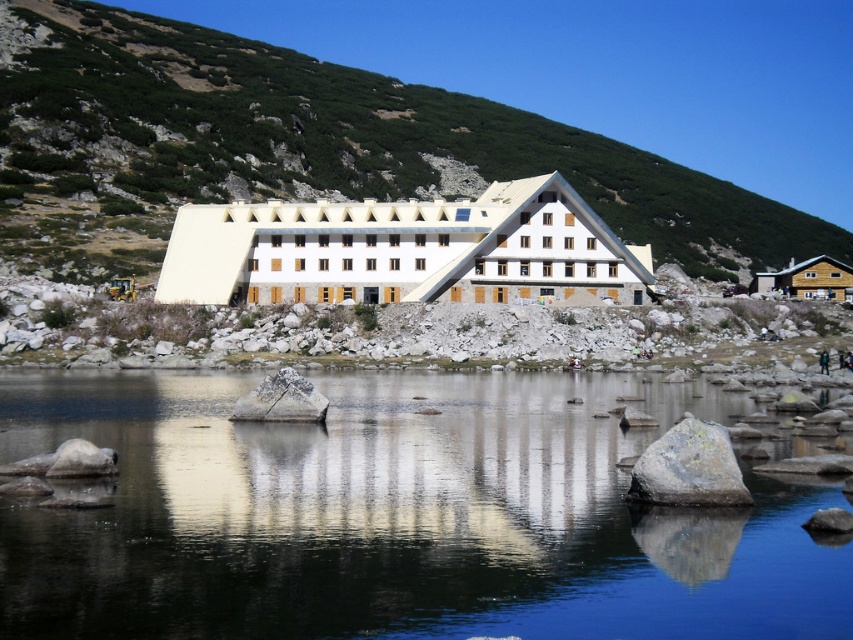
Can you confirm if green grassy hillside at center is taller than white stone building at center?

Indeed, green grassy hillside at center has a greater height compared to white stone building at center.

How much distance is there between green grassy hillside at center and white stone building at center?

A: green grassy hillside at center is 254.39 feet from white stone building at center.

Identify the location of green grassy hillside at center. (302, 148).

Find the location of `green grassy hillside at center`. green grassy hillside at center is located at coordinates (302, 148).

Who is taller, gray rough rock at center or gray rock at center?

Standing taller between the two is gray rough rock at center.

Is gray rough rock at center further to the viewer compared to gray rock at center?

That is False.

Is point (711, 467) farther from camera compared to point (257, 392)?

No, (711, 467) is closer to viewer.

You are a GUI agent. You are given a task and a screenshot of the screen. Output one action in this format:
    pyautogui.click(x=<x>, y=<y>)
    Task: Click on the gray rough rock at center
    This screenshot has width=853, height=640.
    Given the screenshot: What is the action you would take?
    pyautogui.click(x=689, y=468)

Who is more forward, (700, 467) or (86, 468)?

Point (700, 467) is in front.

Does gray rough rock at center have a larger size compared to gray rock at lower left?

Indeed, gray rough rock at center has a larger size compared to gray rock at lower left.

Is point (680, 481) positioned after point (96, 458)?

No, it is in front of (96, 458).

The image size is (853, 640). I want to click on gray rough rock at center, so click(689, 468).